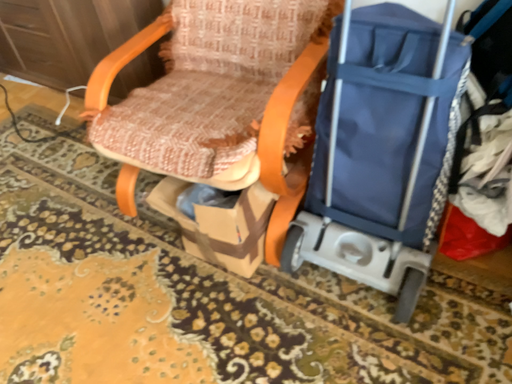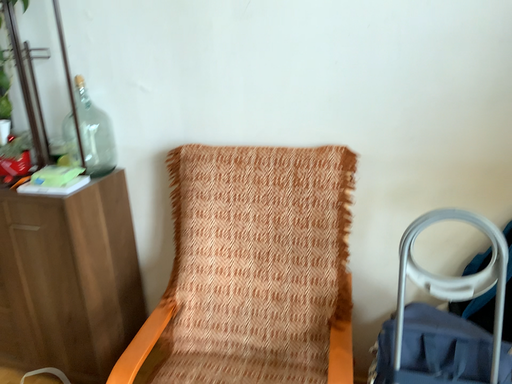
Question: Which way did the camera rotate in the video?

Choices:
 (A) rotated left
 (B) rotated right

Answer: (B)